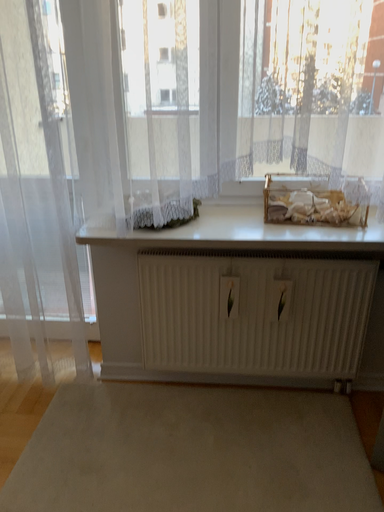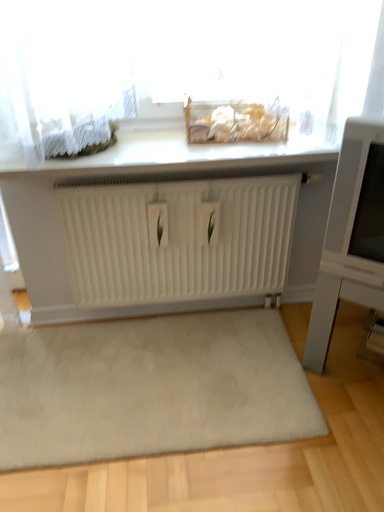
Question: Which way did the camera rotate in the video?

Choices:
 (A) rotated left
 (B) rotated right

Answer: (B)